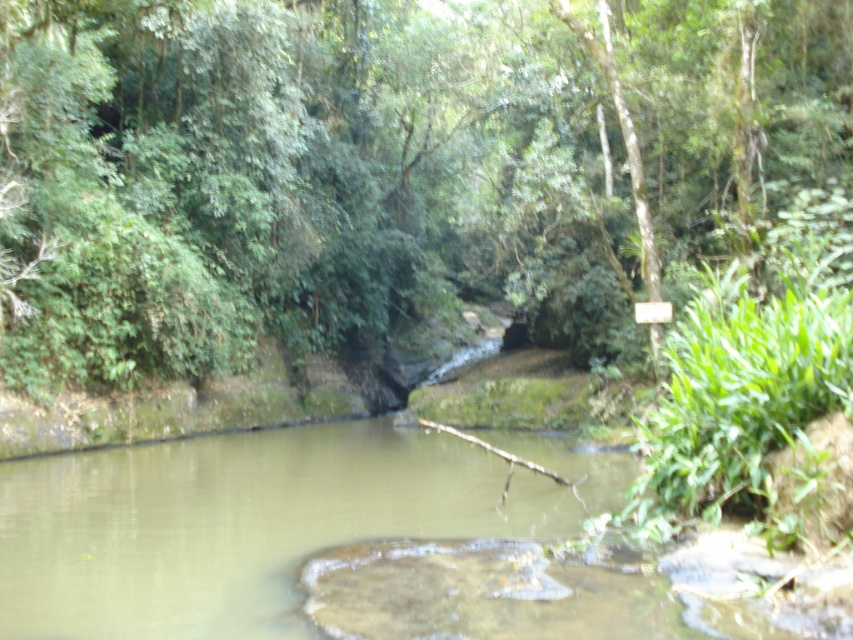
Question: Which point is closer to the camera taking this photo?

Choices:
 (A) (606, 214)
 (B) (125, 605)

Answer: (B)

Question: Observing the image, what is the correct spatial positioning of green leafy tree at center in reference to green mossy rock at center?

Choices:
 (A) left
 (B) right

Answer: (B)

Question: Which of the following is the farthest from the observer?

Choices:
 (A) (318, 99)
 (B) (152, 504)

Answer: (A)

Question: Does green leafy tree at center appear on the right side of green mossy rock at center?

Choices:
 (A) yes
 (B) no

Answer: (A)

Question: Can you confirm if green leafy tree at center is thinner than green mossy rock at center?

Choices:
 (A) no
 (B) yes

Answer: (A)